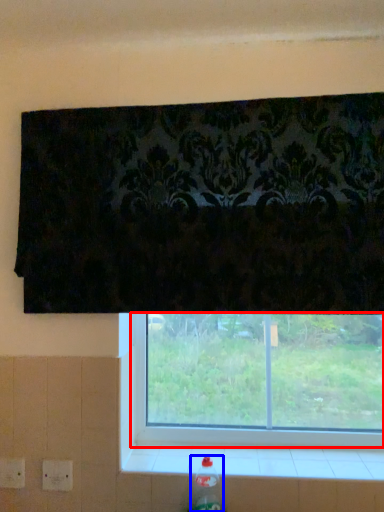
Question: Which object appears farthest to the camera in this image, window (highlighted by a red box) or bottle (highlighted by a blue box)?

Choices:
 (A) window
 (B) bottle

Answer: (A)